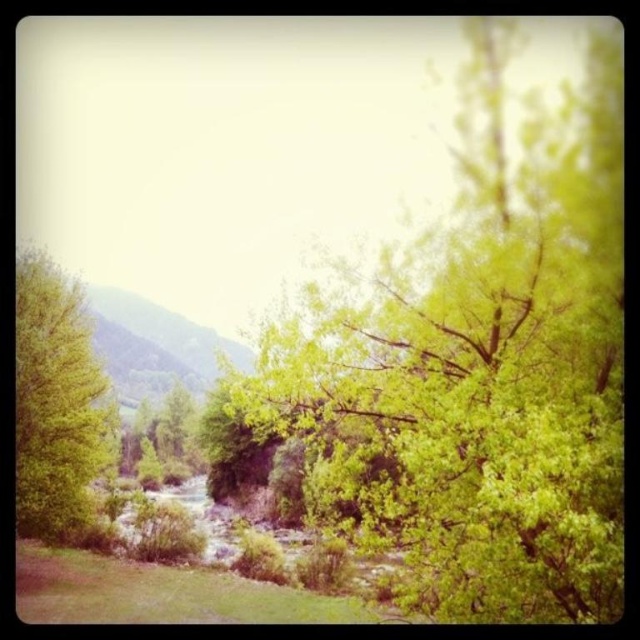
Measure the distance from green leafy tree at center to green leafy tree at left.

green leafy tree at center and green leafy tree at left are 58.14 feet apart.

Is green leafy tree at center closer to camera compared to green leafy tree at left?

Yes, it is in front of green leafy tree at left.

In order to click on green leafy tree at center in this screenshot , I will do `click(481, 369)`.

Locate an element on the screen. This screenshot has height=640, width=640. green leafy tree at center is located at coordinates (481, 369).